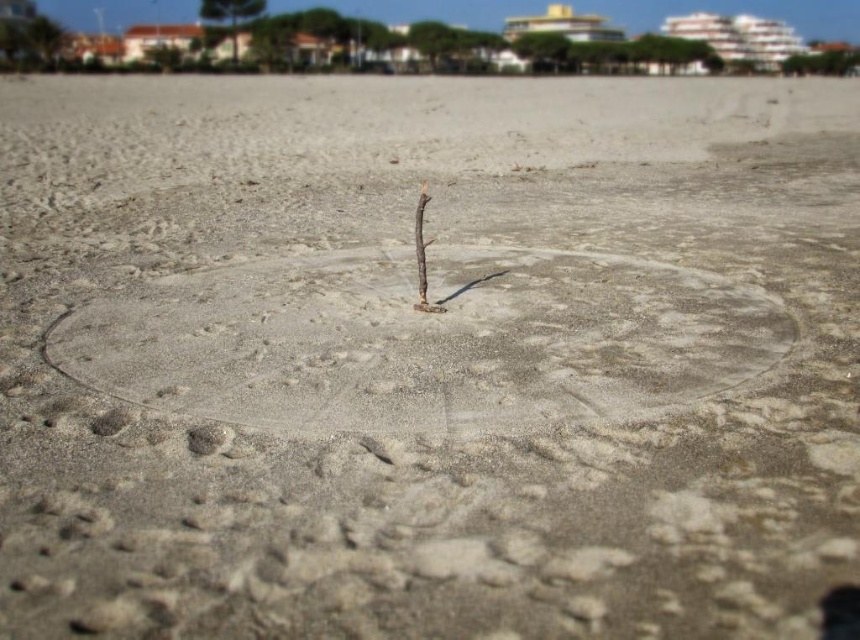
The image size is (860, 640). What do you see at coordinates (424, 340) in the screenshot? I see `smooth sand circle at center` at bounding box center [424, 340].

Is point (648, 291) less distant than point (424, 292)?

No, it is behind (424, 292).

The height and width of the screenshot is (640, 860). What do you see at coordinates (424, 340) in the screenshot?
I see `smooth sand circle at center` at bounding box center [424, 340].

In order to click on smooth sand circle at center in this screenshot , I will do `click(424, 340)`.